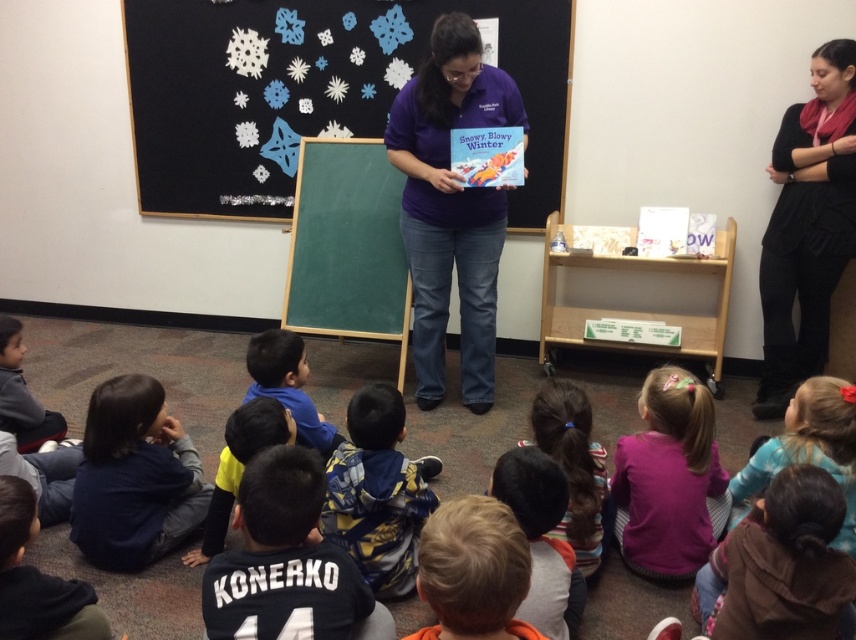
You are a student in the classroom. You need to locate the dark blue sweater at lower left. Where exactly is it located in the image?

The dark blue sweater at lower left is located at point (134, 477).

You are a teacher in the classroom and need to choose a coat for a student who needs a larger size. Which one should you pick between the dark blue sweater at lower left and the blue camouflage jacket at center?

The dark blue sweater at lower left has a larger size compared to the blue camouflage jacket at center, so you should pick the dark blue sweater at lower left.